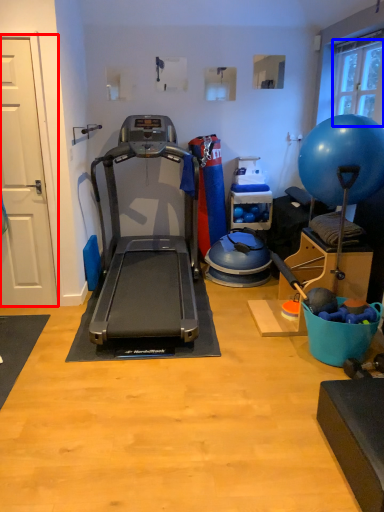
Question: Which object appears closest to the camera in this image, door (highlighted by a red box) or window screen (highlighted by a blue box)?

Choices:
 (A) door
 (B) window screen

Answer: (A)